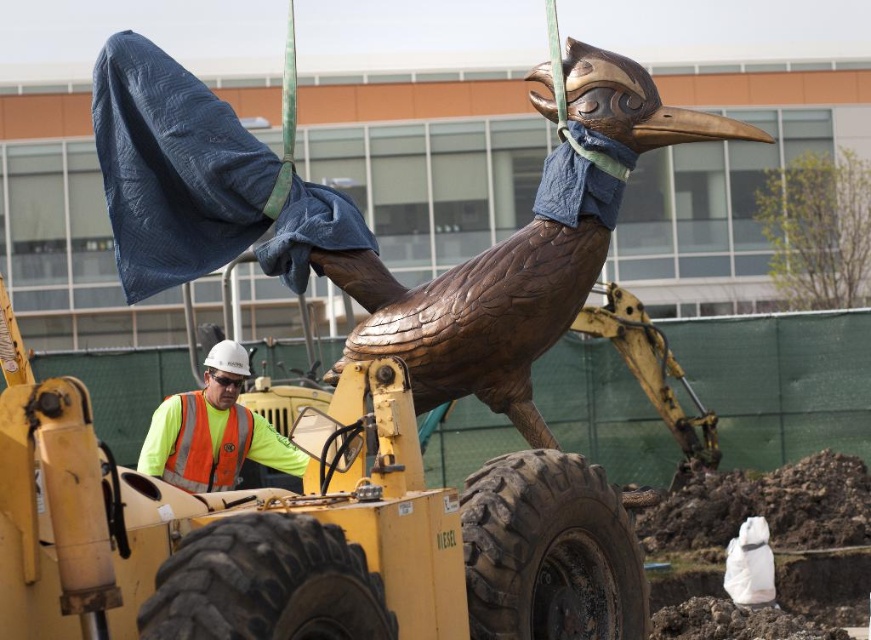
Question: Which object is the farthest from the dark brown rubber tire at lower center?

Choices:
 (A) bronze sculpture at center
 (B) neon yellow reflective vest at center
 (C) reflective orange safety vest at center

Answer: (C)

Question: Is bronze sculpture at center further to the viewer compared to reflective orange safety vest at center?

Choices:
 (A) yes
 (B) no

Answer: (B)

Question: Does black rubber tire at lower center appear over reflective orange safety vest at center?

Choices:
 (A) yes
 (B) no

Answer: (B)

Question: Which of the following is the closest to the observer?

Choices:
 (A) click(106, 131)
 (B) click(215, 342)

Answer: (A)

Question: Which is nearer to the black rubber tire at lower center?

Choices:
 (A) reflective orange safety vest at center
 (B) dark brown rubber tire at lower center

Answer: (B)

Question: Is bronze sculpture at center above neon yellow reflective vest at center?

Choices:
 (A) yes
 (B) no

Answer: (A)